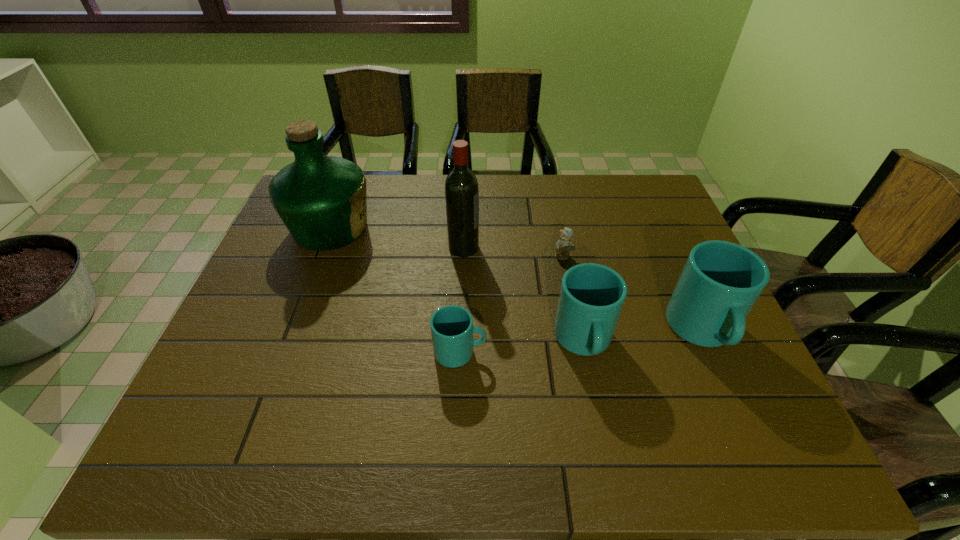
Identify the location of free space for a new cup on the left. The image size is (960, 540). (331, 363).